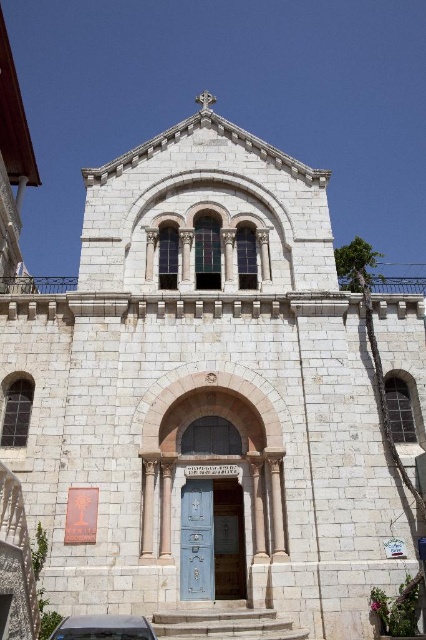
Between blue painted wood door at center and metallic silver car at lower center, which one appears on the left side from the viewer's perspective?

From the viewer's perspective, metallic silver car at lower center appears more on the left side.

Between point (189, 531) and point (138, 627), which one is positioned in front?

Point (138, 627) is in front.

Measure the distance between point (203, 512) and camera.

The distance of point (203, 512) from camera is 40.24 meters.

Locate an element on the screen. blue painted wood door at center is located at coordinates (212, 540).